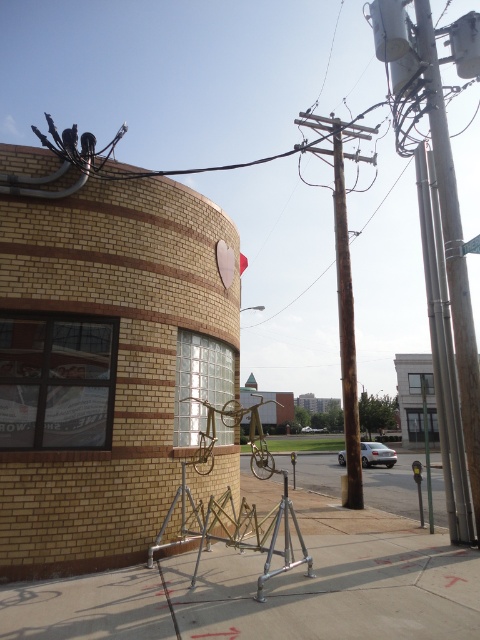
Question: Which object appears farthest from the camera in this image?

Choices:
 (A) rusty metal pole at right
 (B) concrete sidewalk at lower center
 (C) metallic street sign at lower right
 (D) concrete sidewalk at center

Answer: (B)

Question: Which point is farther from the camera taking this photo?

Choices:
 (A) (364, 476)
 (B) (444, 145)

Answer: (A)

Question: From the image, what is the correct spatial relationship of rusty metal pole at right in relation to metallic street sign at lower right?

Choices:
 (A) above
 (B) below

Answer: (A)

Question: Can you confirm if concrete sidewalk at center is wider than rusty metal pole at right?

Choices:
 (A) no
 (B) yes

Answer: (B)

Question: Is rusty metal pole at right smaller than concrete sidewalk at lower center?

Choices:
 (A) yes
 (B) no

Answer: (A)

Question: Which point is closer to the camera?

Choices:
 (A) concrete sidewalk at center
 (B) metallic street sign at lower right

Answer: (A)